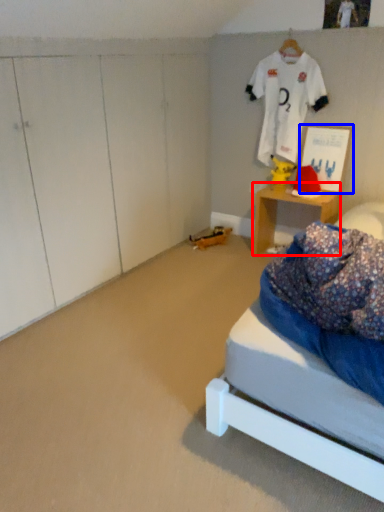
Question: Among these objects, which one is farthest to the camera, desk (highlighted by a red box) or picture frame (highlighted by a blue box)?

Choices:
 (A) desk
 (B) picture frame

Answer: (A)